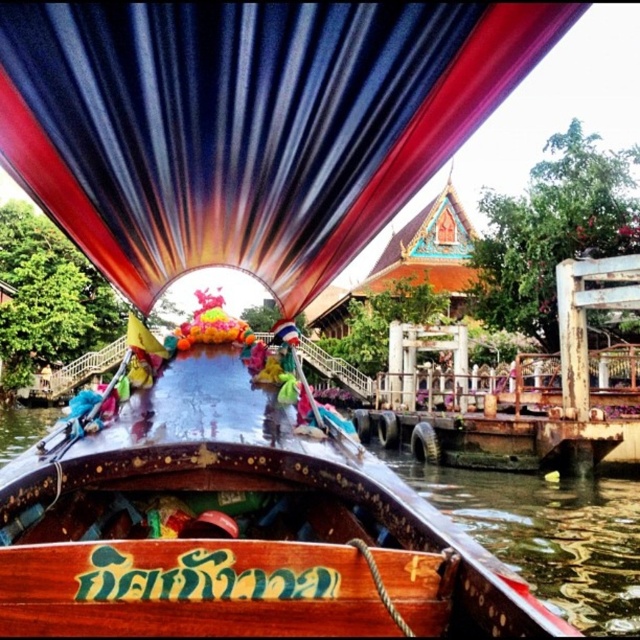
Question: Which object is farther from the camera taking this photo?

Choices:
 (A) blue striped fabric canopy at center
 (B) polished wood boat at center

Answer: (A)

Question: Which object is farther from the camera taking this photo?

Choices:
 (A) polished wood boat at center
 (B) blue striped fabric canopy at center

Answer: (B)

Question: Considering the relative positions of blue striped fabric canopy at center and polished wood boat at center in the image provided, where is blue striped fabric canopy at center located with respect to polished wood boat at center?

Choices:
 (A) left
 (B) right

Answer: (A)

Question: Is blue striped fabric canopy at center smaller than polished wood boat at center?

Choices:
 (A) no
 (B) yes

Answer: (B)

Question: Does blue striped fabric canopy at center come in front of polished wood boat at center?

Choices:
 (A) yes
 (B) no

Answer: (B)